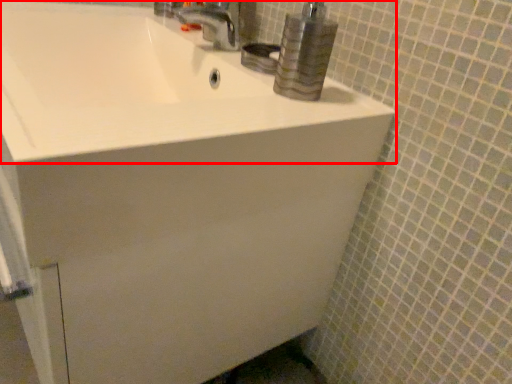
Question: Where is sink (annotated by the red box) located in relation to tap in the image?

Choices:
 (A) right
 (B) left

Answer: (B)